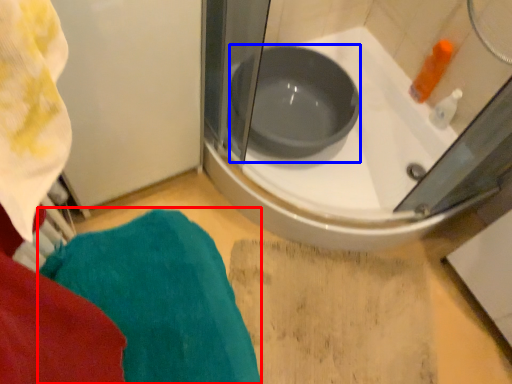
Question: Which point is closer to the camera, bath towel (highlighted by a red box) or basin (highlighted by a blue box)?

Choices:
 (A) bath towel
 (B) basin

Answer: (A)